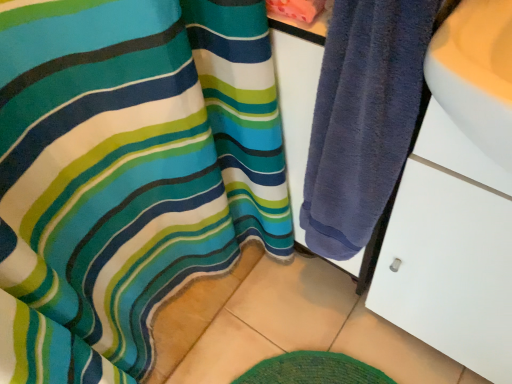
Question: Considering their positions, is white matte drawer at right located in front of or behind dark blue towel at right?

Choices:
 (A) front
 (B) behind

Answer: (A)

Question: Is white matte drawer at right bigger or smaller than dark blue towel at right?

Choices:
 (A) small
 (B) big

Answer: (B)

Question: Looking at their shapes, would you say white matte drawer at right is wider or thinner than dark blue towel at right?

Choices:
 (A) thin
 (B) wide

Answer: (B)

Question: Is dark blue towel at right spatially inside white matte drawer at right, or outside of it?

Choices:
 (A) outside
 (B) inside

Answer: (A)

Question: From the image's perspective, is dark blue towel at right above or below white matte drawer at right?

Choices:
 (A) above
 (B) below

Answer: (A)

Question: Considering their positions, is dark blue towel at right located in front of or behind white matte drawer at right?

Choices:
 (A) behind
 (B) front

Answer: (A)

Question: Is dark blue towel at right to the left or to the right of white matte drawer at right in the image?

Choices:
 (A) left
 (B) right

Answer: (A)